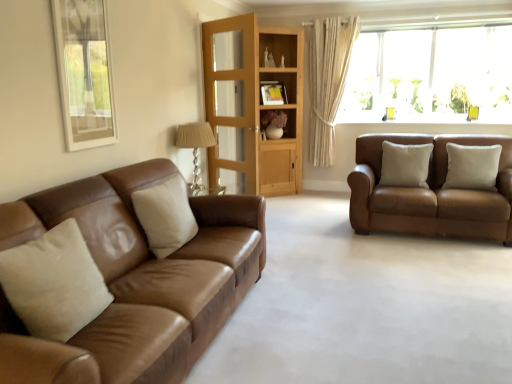
What is the approximate width of transparent glass door at center?

transparent glass door at center is 7.22 inches wide.

I want to click on translucent glass window at upper right, so click(430, 75).

In order to click on beige leather pillow at right, which appears as the 2th pillow when viewed from the back in this screenshot , I will do `click(472, 167)`.

From a real-world perspective, who is located lower, beige leather pillow at left, the 3th pillow from the right, or transparent glass door at center?

beige leather pillow at left, the 3th pillow from the right, from a real-world perspective.

Which of these two, beige leather pillow at left, positioned as the third pillow in back-to-front order, or transparent glass door at center, is thinner?

With smaller width is transparent glass door at center.

From the picture: Between beige leather pillow at left, positioned as the third pillow in back-to-front order, and transparent glass door at center, which one has more height?

Standing taller between the two is transparent glass door at center.

Is point (152, 234) positioned behind point (284, 56)?

No, (152, 234) is closer to viewer.

How distant is beige leather pillow at left, the 2th pillow when ordered from front to back, from light wood cabinet at center?

beige leather pillow at left, the 2th pillow when ordered from front to back, and light wood cabinet at center are 2.89 meters apart.

From a real-world perspective, who is located higher, beige leather pillow at left, the 3th pillow from the right, or light wood cabinet at center?

From a 3D spatial view, light wood cabinet at center is above.

Which is more to the right, beige leather pillow at left, the second pillow in the left-to-right sequence, or light wood cabinet at center?

light wood cabinet at center is more to the right.

Is point (155, 199) positioned behind point (327, 22)?

No, (155, 199) is in front of (327, 22).

Is beige fabric curtain at upper right inside beige leather pillow at left, positioned as the third pillow in back-to-front order?

No, beige leather pillow at left, positioned as the third pillow in back-to-front order, does not contain beige fabric curtain at upper right.

Is beige leather pillow at left, positioned as the third pillow in back-to-front order, bigger or smaller than beige fabric curtain at upper right?

beige leather pillow at left, positioned as the third pillow in back-to-front order, is smaller than beige fabric curtain at upper right.

In the scene shown: Is beige leather pillow at left, positioned as the third pillow in back-to-front order, to the right of beige fabric curtain at upper right from the viewer's perspective?

Incorrect, beige leather pillow at left, positioned as the third pillow in back-to-front order, is not on the right side of beige fabric curtain at upper right.

Is beige leather pillow at right, which is the third pillow from left to right, oriented away from beige fabric pillow at left, which ranks as the 4th pillow in right-to-left order?

No, beige leather pillow at right, which is the third pillow from left to right, is not facing the opposite direction of beige fabric pillow at left, which ranks as the 4th pillow in right-to-left order.

Which pillow is the 3rd one when counting from the front of the beige leather pillow at right, which is the third pillow from left to right? Please provide its 2D coordinates.

[(54, 283)]

Based on the photo, which is correct: beige leather pillow at right, which is the third pillow from left to right, is inside beige fabric pillow at left, the 4th pillow from the back, or outside of it?

beige leather pillow at right, which is the third pillow from left to right, cannot be found inside beige fabric pillow at left, the 4th pillow from the back.

Which is in front, point (412, 154) or point (39, 289)?

The point (39, 289) is in front.

Who is taller, transparent glass door at center or beige pleated fabric lampshade at center?

transparent glass door at center is taller.

From the picture: From a real-world perspective, is transparent glass door at center physically above beige pleated fabric lampshade at center?

Yes, from a real-world perspective, transparent glass door at center is on top of beige pleated fabric lampshade at center.

Is transparent glass door at center turned away from beige pleated fabric lampshade at center?

That's right, transparent glass door at center is facing away from beige pleated fabric lampshade at center.

Considering their positions, is transparent glass door at center located in front of or behind beige pleated fabric lampshade at center?

transparent glass door at center is behind beige pleated fabric lampshade at center.

Would you consider translucent glass window at upper right to be distant from brown leather couch at right, marked as the 2th studio couch in a front-to-back arrangement?

Yes.

From the image's perspective, is translucent glass window at upper right under brown leather couch at right, which is the 1th studio couch in back-to-front order?

No.

Is translucent glass window at upper right thinner than brown leather couch at right, which is the 1th studio couch in back-to-front order?

Indeed, translucent glass window at upper right has a lesser width compared to brown leather couch at right, which is the 1th studio couch in back-to-front order.

Is translucent glass window at upper right at the right side of brown leather couch at right, marked as the 2th studio couch in a front-to-back arrangement?

Indeed, translucent glass window at upper right is positioned on the right side of brown leather couch at right, marked as the 2th studio couch in a front-to-back arrangement.

Between point (294, 131) and point (402, 96), which one is positioned behind?

The point (402, 96) is farther from the camera.

Is matte brown shelf at center positioned beyond the bounds of translucent glass window at upper right?

Indeed, matte brown shelf at center is completely outside translucent glass window at upper right.

Visually, is matte brown shelf at center positioned to the left or to the right of translucent glass window at upper right?

In the image, matte brown shelf at center appears on the left side of translucent glass window at upper right.

In order to click on screen door above the beige leather pillow at left, positioned as the third pillow in back-to-front order (from a real-world perspective) in this screenshot , I will do `click(231, 101)`.

The image size is (512, 384). Find the location of `pillow that is the 4th one below the light wood cabinet at center (from a real-world perspective)`. pillow that is the 4th one below the light wood cabinet at center (from a real-world perspective) is located at coordinates (165, 216).

Looking at the image, which one is located further to beige pleated fabric lampshade at center, translucent glass window at upper right or beige leather pillow at left, the second pillow in the left-to-right sequence?

Based on the image, translucent glass window at upper right appears to be further to beige pleated fabric lampshade at center.

When comparing their distances from light wood cabinet at center, does beige leather pillow at right, arranged as the 4th pillow when viewed from the front, or matte brown shelf at center seem further?

The object further to light wood cabinet at center is beige leather pillow at right, arranged as the 4th pillow when viewed from the front.

Estimate the real-world distances between objects in this image. Which object is closer to brown leather couch at right, arranged as the second studio couch when viewed from the left, matte brown leather couch at left, which is the 1th studio couch in left-to-right order, or beige leather pillow at right, acting as the 1th pillow starting from the back?

beige leather pillow at right, acting as the 1th pillow starting from the back.

Which object lies nearer to the anchor point transparent glass door at center, beige leather pillow at left, positioned as the third pillow in back-to-front order, or beige leather pillow at right, which ranks as the third pillow in front-to-back order?

beige leather pillow at left, positioned as the third pillow in back-to-front order, is positioned closer to the anchor transparent glass door at center.

From the picture: When comparing their distances from transparent glass door at center, does matte brown leather couch at left, which is the second studio couch in back-to-front order, or light wood cabinet at center seem closer?

Result: Among the two, light wood cabinet at center is located nearer to transparent glass door at center.

Looking at the image, which one is located closer to beige fabric pillow at left, the 4th pillow from the back, beige leather pillow at right, placed as the fourth pillow when sorted from left to right, or beige fabric curtain at upper right?

Based on the image, beige leather pillow at right, placed as the fourth pillow when sorted from left to right, appears to be nearer to beige fabric pillow at left, the 4th pillow from the back.

When comparing their distances from beige fabric pillow at left, which ranks as the 4th pillow in right-to-left order, does light wood cabinet at center or beige leather pillow at left, positioned as the third pillow in back-to-front order, seem closer?

beige leather pillow at left, positioned as the third pillow in back-to-front order.

Which object lies further to the anchor point transparent glass door at center, beige pleated fabric lampshade at center or beige leather pillow at right, arranged as the 4th pillow when viewed from the front?

The object further to transparent glass door at center is beige leather pillow at right, arranged as the 4th pillow when viewed from the front.

Image resolution: width=512 pixels, height=384 pixels. Identify the location of lamp between beige leather pillow at left, the 2th pillow when ordered from front to back, and matte brown shelf at center in the front-back direction. (195, 148).

Locate an element on the screen. cabinet located between transparent glass door at center and beige fabric curtain at upper right in the depth direction is located at coordinates (284, 111).

What are the coordinates of `studio couch situated between beige pleated fabric lampshade at center and beige leather pillow at right, which appears as the 2th pillow when viewed from the back, from left to right` in the screenshot? It's located at (430, 193).

Where is `window between beige fabric pillow at left, which is the 1th pillow in front-to-back order, and light wood cabinet at center from front to back`? The image size is (512, 384). window between beige fabric pillow at left, which is the 1th pillow in front-to-back order, and light wood cabinet at center from front to back is located at coordinates (430, 75).